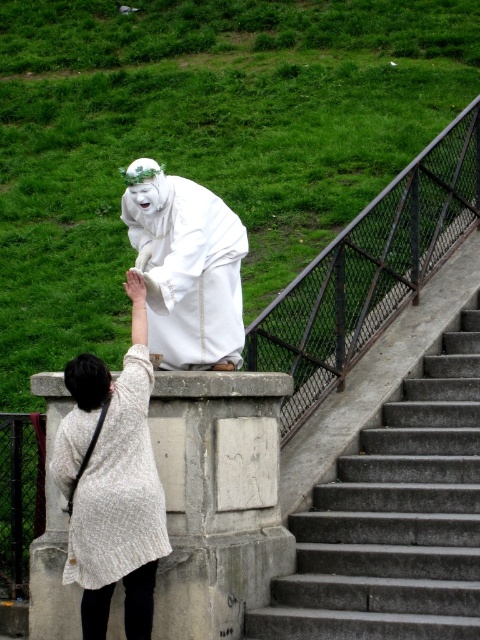
Question: Does concrete stairs at center have a larger size compared to rusty metal rail at upper center?

Choices:
 (A) no
 (B) yes

Answer: (B)

Question: Which of the following is the closest to the observer?

Choices:
 (A) concrete stairs at center
 (B) white matte statue at upper center
 (C) rusty metal rail at upper center
 (D) white textured coat at center

Answer: (D)

Question: From the image, what is the correct spatial relationship of rusty metal rail at upper center in relation to white textured coat at center?

Choices:
 (A) above
 (B) below

Answer: (A)

Question: Is rusty metal rail at upper center thinner than white textured coat at center?

Choices:
 (A) no
 (B) yes

Answer: (B)

Question: Among these objects, which one is nearest to the camera?

Choices:
 (A) white matte statue at upper center
 (B) concrete stairs at center
 (C) white textured coat at center
 (D) rusty metal rail at upper center

Answer: (C)

Question: Which of the following is the closest to the observer?

Choices:
 (A) (374, 282)
 (B) (181, 353)
 (C) (417, 524)

Answer: (C)